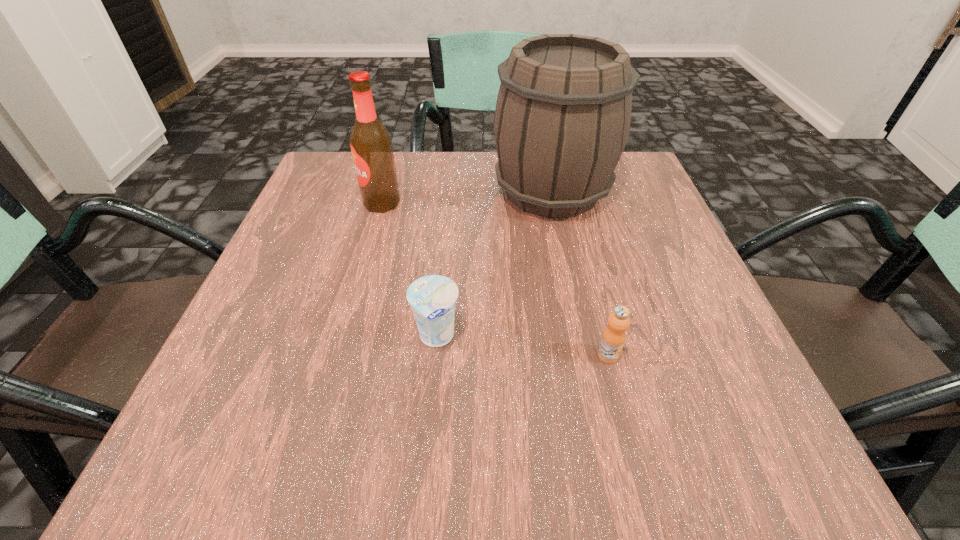
This screenshot has width=960, height=540. I want to click on wine bucket, so click(562, 119).

This screenshot has height=540, width=960. What are the coordinates of `beer bottle` in the screenshot? It's located at (371, 144).

Find the location of `orange juice`. orange juice is located at coordinates (614, 335).

You are a GUI agent. You are given a task and a screenshot of the screen. Output one action in this format:
    pyautogui.click(x=<x>, y=<y>)
    Task: Click on the second object from left to right
    
    Given the screenshot: What is the action you would take?
    pyautogui.click(x=432, y=297)

This screenshot has width=960, height=540. Find the location of `vacant area located 0.200m on the front of the wine bucket`. vacant area located 0.200m on the front of the wine bucket is located at coordinates (575, 301).

Identify the location of free region located 0.280m on the right of the beer bottle. (531, 203).

Find the location of a particular element. This screenshot has width=960, height=540. vacant space located on the front label of the orange juice is located at coordinates (631, 443).

You are a GUI agent. You are given a task and a screenshot of the screen. Output one action in this format:
    pyautogui.click(x=<x>, y=<y>)
    Task: Click on the vacant area located 0.100m on the back of the yogurt
    
    Given the screenshot: What is the action you would take?
    pyautogui.click(x=443, y=274)

Image resolution: width=960 pixels, height=540 pixels. I want to click on wine bucket that is at the far edge, so click(x=562, y=119).

Locate an element on the screen. This screenshot has width=960, height=540. beer bottle that is at the far edge is located at coordinates (371, 144).